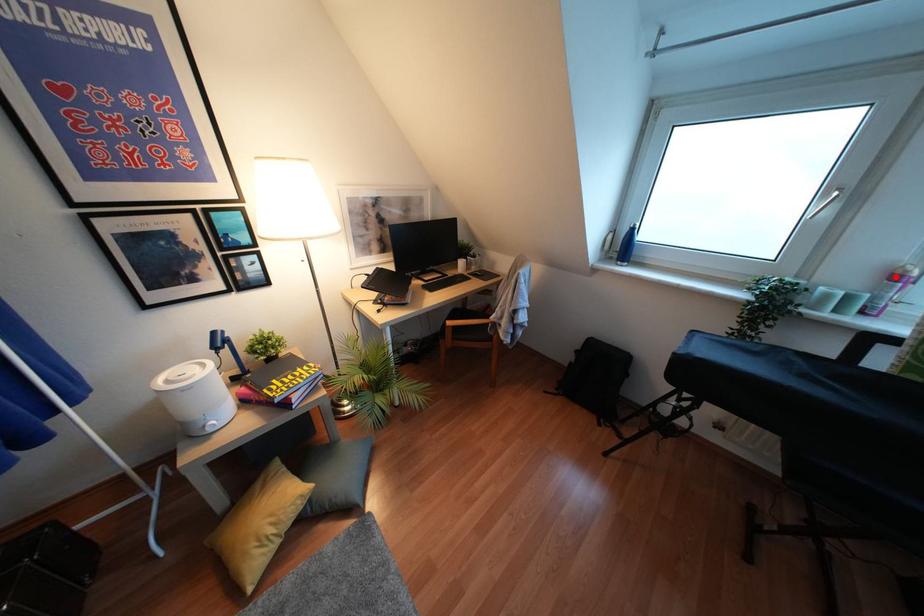
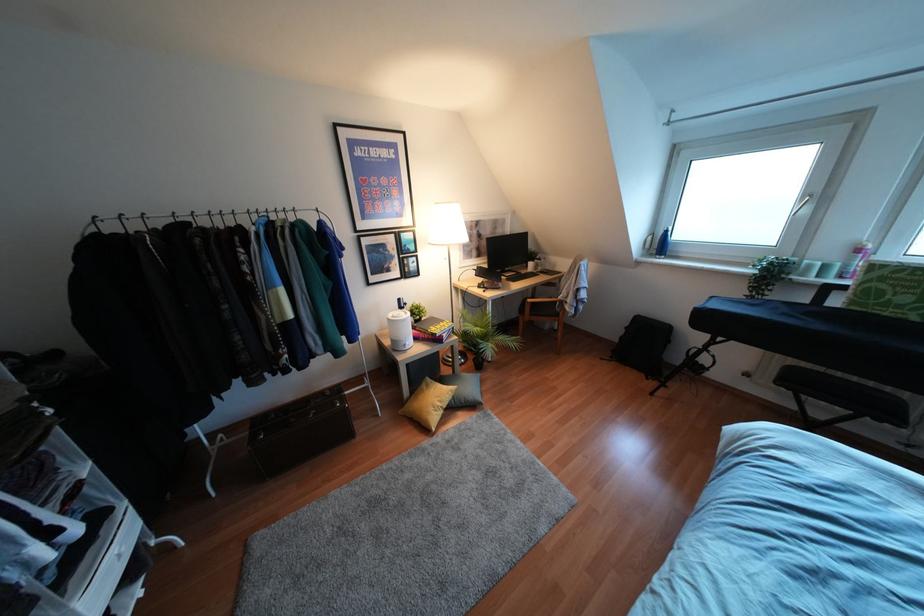
Find the pixel in the second image that matches the highlighted location in the first image.

(858, 249)